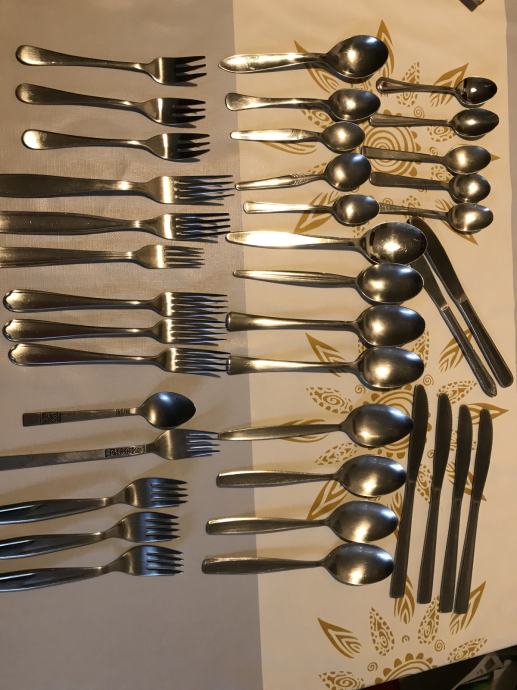
This screenshot has width=517, height=690. Find the location of `teaspoons`. teaspoons is located at coordinates (162, 413), (357, 210), (484, 119), (476, 217), (472, 190), (469, 157), (485, 90), (354, 167), (362, 104).